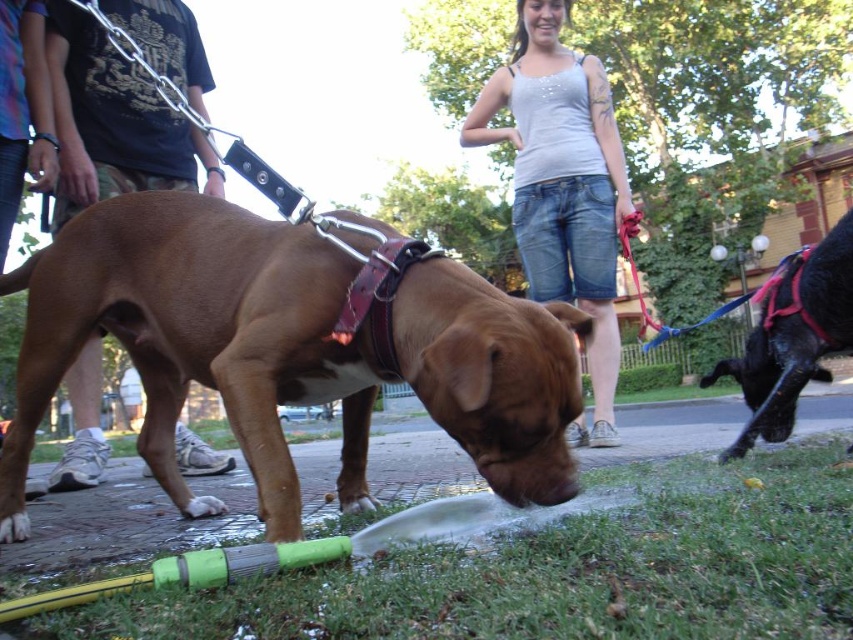
Based on the photo, you are a photographer trying to capture both the denim shorts at center and the shiny black dog at right in a single frame. Based on their positions, which object should you adjust your camera angle to focus on first to ensure both are in the shot?

The denim shorts at center is to the left of shiny black dog at right, so you should first focus on the shiny black dog at right to ensure both are captured in the frame.

Please provide the 2D coordinates of the brown leather dog at center in the image. The coordinates should be in the format of a point with two decimal places, like this example format. Please do not add any extra information beyond the coordinates.

The 2D coordinates of the brown leather dog at center are at point (196,339).

From the picture: You are a photographer trying to capture a clear photo of the brown leather dog at center and the brown leather leash at left. Which object should you focus on first to ensure it appears sharp in the photo?

The brown leather dog at center should be focused on first because it is closer to the viewer than the brown leather leash at left, ensuring it appears sharp.